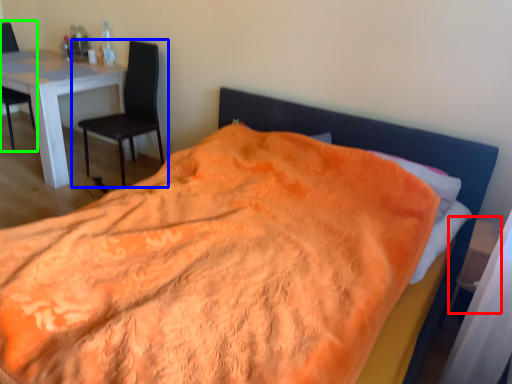
Question: Which is farther away from side table (highlighted by a red box)? chair (highlighted by a blue box) or chair (highlighted by a green box)?

Choices:
 (A) chair
 (B) chair

Answer: (B)